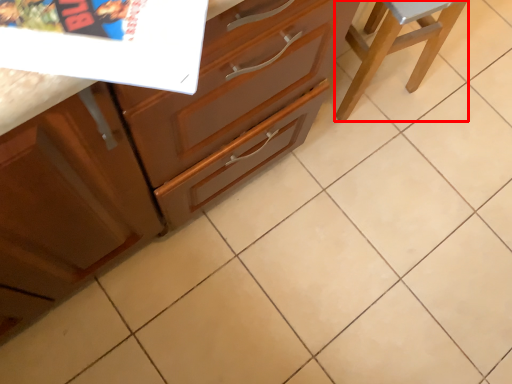
Question: From the image's perspective, where is furniture (annotated by the red box) located in relation to cabinetry in the image?

Choices:
 (A) above
 (B) below

Answer: (A)